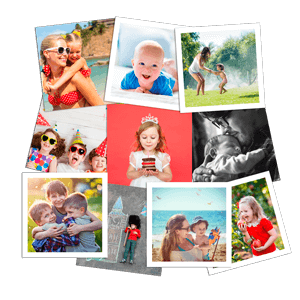
You are a GUI agent. You are given a task and a screenshot of the screen. Output one action in this format:
    pyautogui.click(x=<x>, y=<y>)
    Task: Click on the pictures
    The image size is (300, 300).
    Given the screenshot: What is the action you would take?
    pyautogui.click(x=252, y=232), pyautogui.click(x=196, y=219), pyautogui.click(x=133, y=213), pyautogui.click(x=78, y=212), pyautogui.click(x=87, y=68), pyautogui.click(x=84, y=127), pyautogui.click(x=141, y=139), pyautogui.click(x=141, y=38), pyautogui.click(x=206, y=76), pyautogui.click(x=216, y=144)